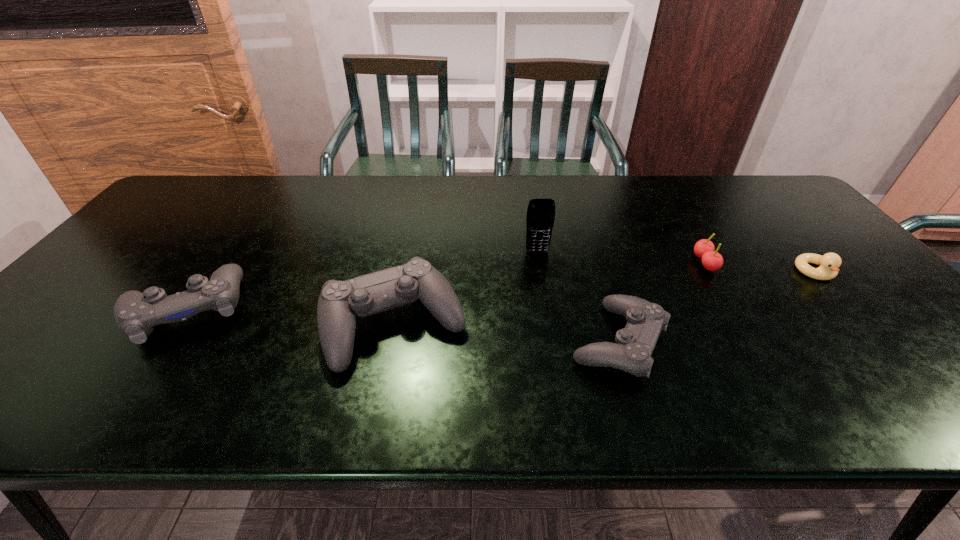
Please point out where to position a new control on the right to maintain spacing. Please provide its 2D coordinates. Your answer should be formatted as a tuple, i.e. [(x, y)], where the tuple contains the x and y coordinates of a point satisfying the conditions above.

[(859, 359)]